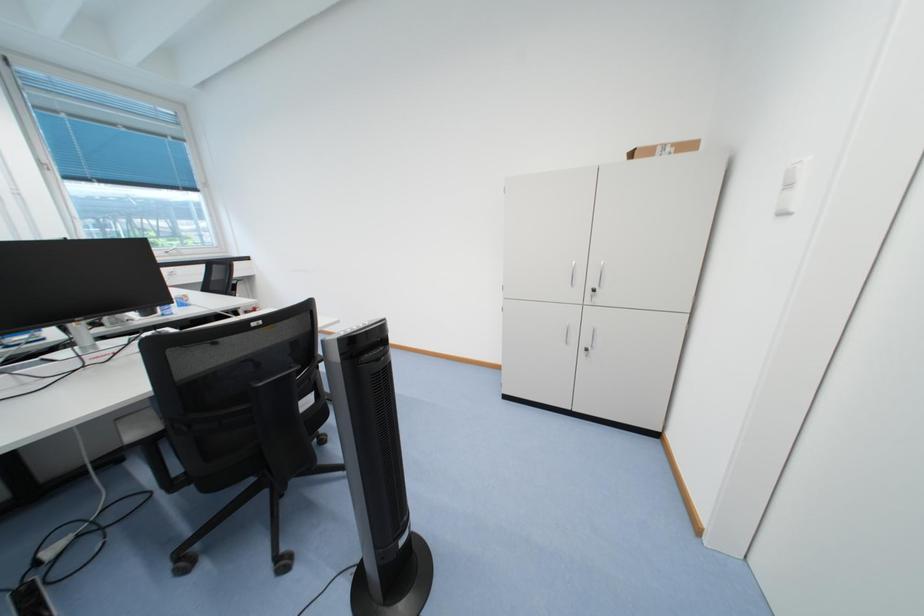
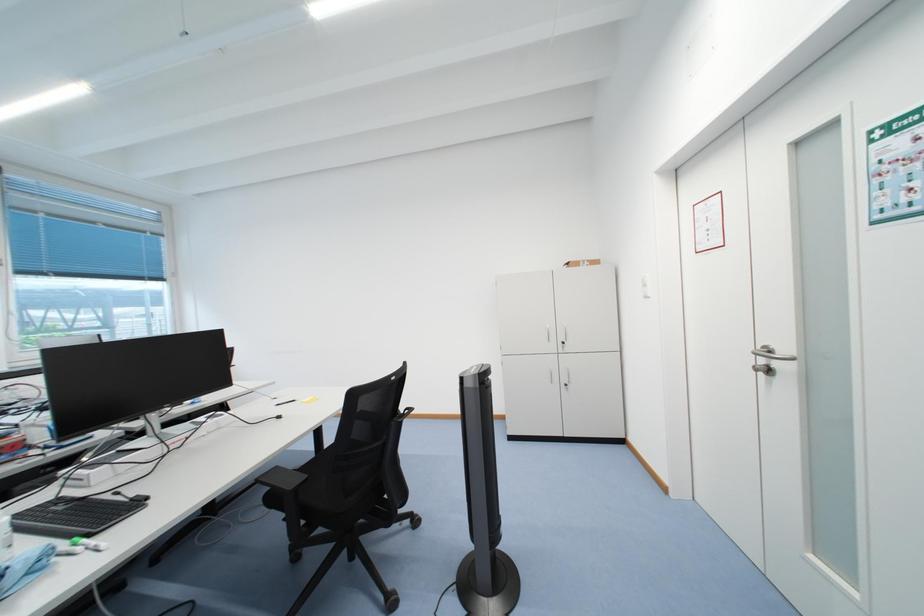
Question: Based on the continuous images, in which direction is the camera rotating? Reply with the corresponding letter.

Choices:
 (A) Left
 (B) Right
 (C) Up
 (D) Down

Answer: (C)